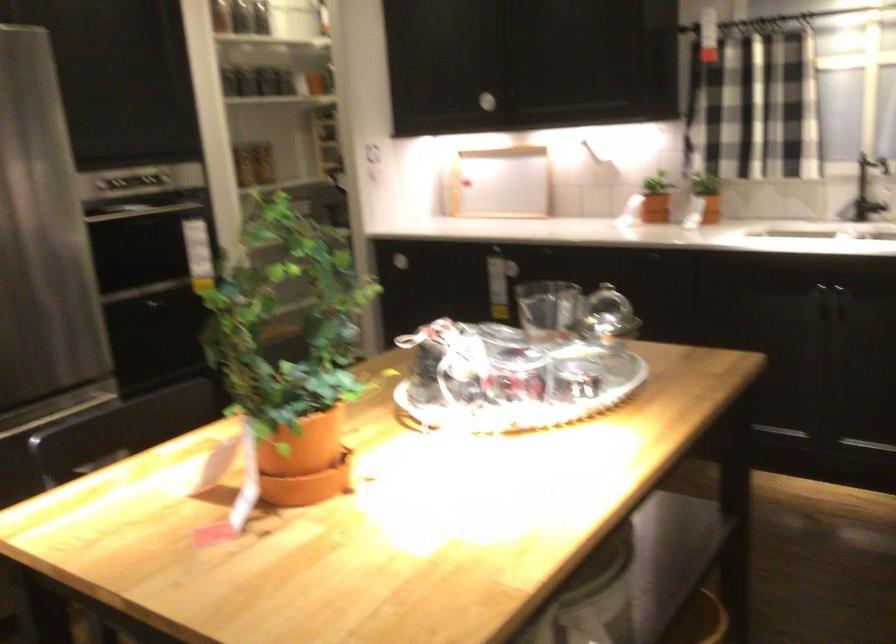
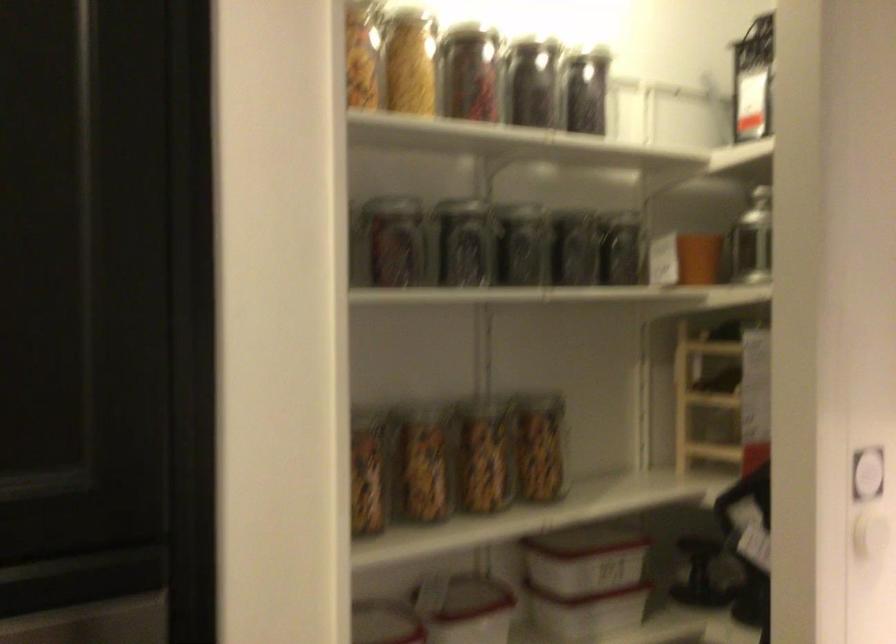
The point at [316,71] is marked in the first image. Where is the corresponding point in the second image?

(698, 258)